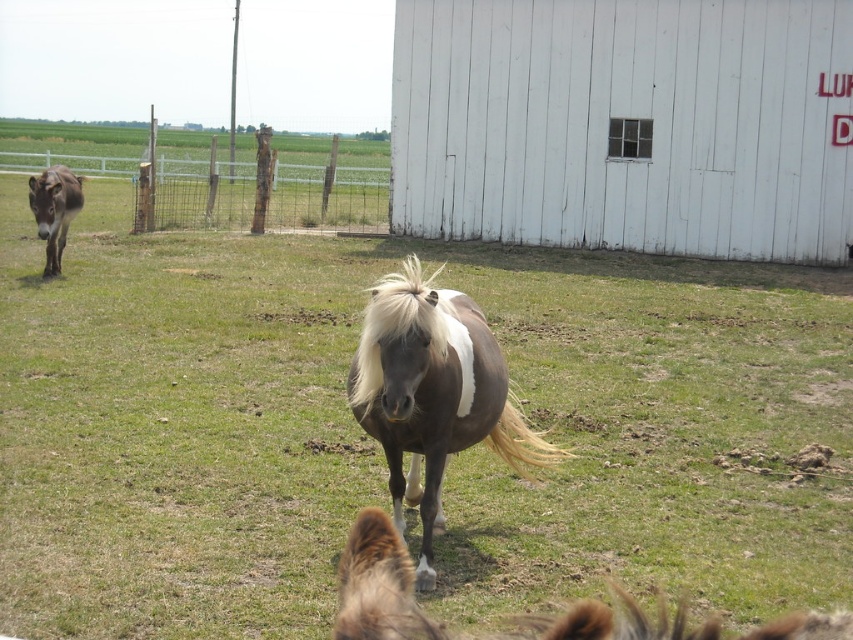
Question: Which point is closer to the camera taking this photo?

Choices:
 (A) (393, 506)
 (B) (780, 164)

Answer: (A)

Question: Based on their relative distances, which object is nearer to the dark brown fur at left?

Choices:
 (A) green grassy at center
 (B) white wooden barn at center

Answer: (A)

Question: Does green grassy at center appear on the right side of dark brown fur at left?

Choices:
 (A) no
 (B) yes

Answer: (B)

Question: Is the position of white wooden barn at center more distant than that of shiny brown horse at center?

Choices:
 (A) yes
 (B) no

Answer: (A)

Question: Among these points, which one is farthest from the camera?

Choices:
 (A) (792, 627)
 (B) (421, 51)

Answer: (B)

Question: Is brown glossy horse at center thinner than dark brown fur at left?

Choices:
 (A) no
 (B) yes

Answer: (B)